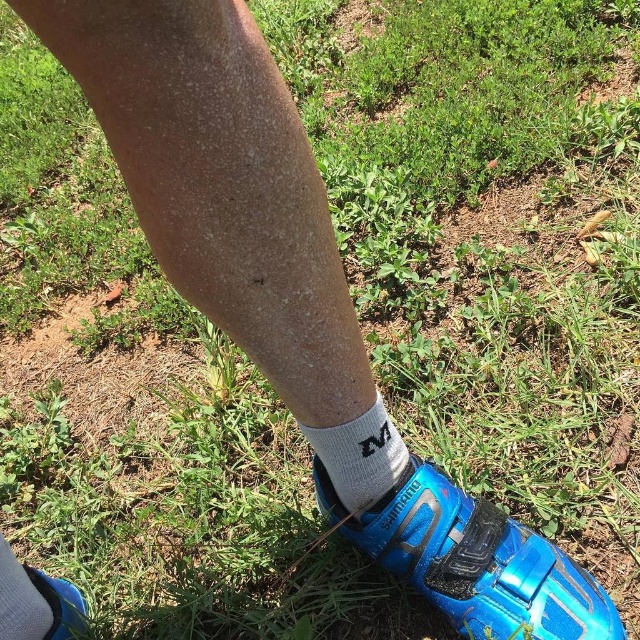
You are a photographer trying to capture the white cotton sock at lower center. The camera is focused on the point marked as point (358, 456). Is the sock in focus?

The white cotton sock at lower center is represented by point (358, 456), so yes, the sock is in focus since the camera is focused on that point.

You are a photographer setting up a shoot on a grassy field. You need to position a model so that their white cotton sock at lower left and blue matte shoe at lower right are visible in the frame. Based on their current positions, which object is closer to the left edge of the photo?

The white cotton sock at lower left is closer to the left edge of the photo because it is positioned to the left of the blue matte shoe at lower right.